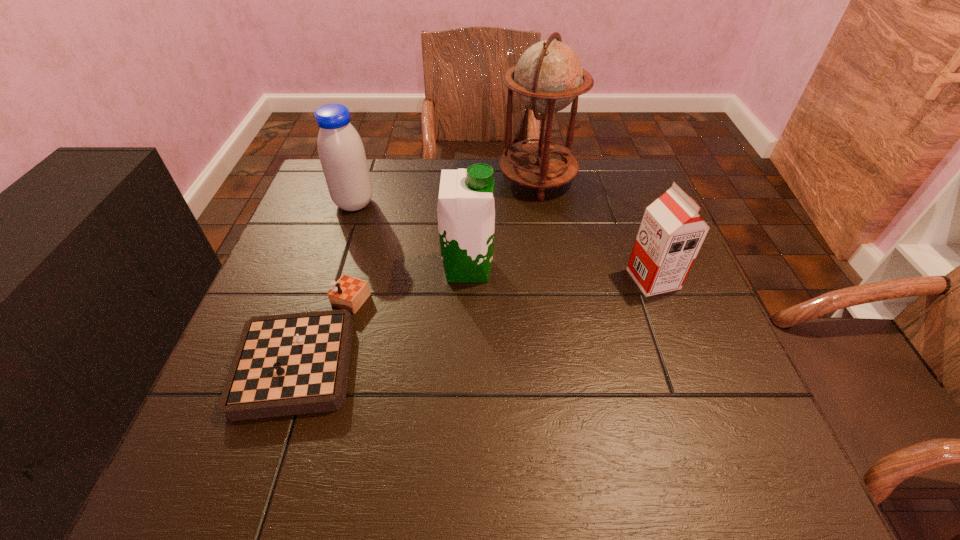
Locate an element on the screen. free area in between the fourth object from left to right and the chessboard is located at coordinates (420, 262).

The height and width of the screenshot is (540, 960). I want to click on vacant area that lies between the second object from right to left and the third object from left to right, so click(x=502, y=224).

The width and height of the screenshot is (960, 540). I want to click on vacant point located between the shortest object and the second soya milk from right to left, so click(385, 307).

Select which object appears as the fourth closest to the tallest object. Please provide its 2D coordinates. Your answer should be formatted as a tuple, i.e. [(x, y)], where the tuple contains the x and y coordinates of a point satisfying the conditions above.

[(289, 364)]

This screenshot has height=540, width=960. What are the coordinates of `object that is the closest to the fourth object from left to right` in the screenshot? It's located at click(466, 211).

You are a GUI agent. You are given a task and a screenshot of the screen. Output one action in this format:
    pyautogui.click(x=<x>, y=<y>)
    Task: Click on the third closest soya milk to the globe
    The width and height of the screenshot is (960, 540).
    Given the screenshot: What is the action you would take?
    pyautogui.click(x=342, y=155)

The image size is (960, 540). I want to click on soya milk identified as the closest to the rightmost object, so click(x=466, y=211).

This screenshot has width=960, height=540. In order to click on vacant region that satisfies the following two spatial constraints: 1. on the front-facing side of the third object from left to right; 2. on the back side of the rightmost object in this screenshot , I will do `click(468, 279)`.

You are a GUI agent. You are given a task and a screenshot of the screen. Output one action in this format:
    pyautogui.click(x=<x>, y=<y>)
    Task: Click on the free space that satisfies the following two spatial constraints: 1. on the back side of the rightmost soya milk; 2. on the left side of the chessboard
    This screenshot has height=540, width=960.
    Given the screenshot: What is the action you would take?
    coord(325,279)

At what (x,y) coordinates should I click in order to perform the action: click on vacant position in the image that satisfies the following two spatial constraints: 1. on the surface of the globe; 2. on the back side of the rightmost object. Please return your answer as a coordinate pair (x, y). Looking at the image, I should click on (553, 279).